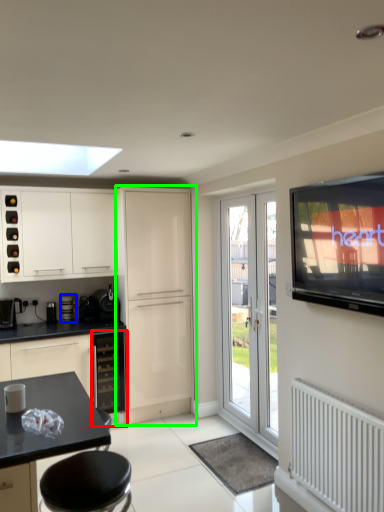
Question: Based on their relative distances, which object is farther from oven (highlighted by a red box)? Choose from appliance (highlighted by a blue box) and cabinetry (highlighted by a green box).

Choices:
 (A) appliance
 (B) cabinetry

Answer: (A)